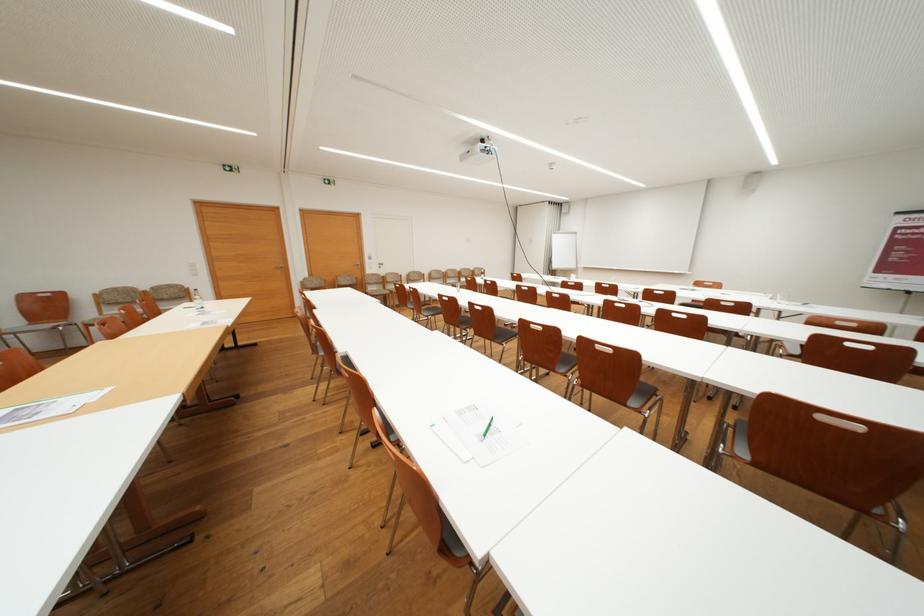
Where would you lift the brown chair back handle? Please return your answer as a coordinate pair (x, y).

(832, 458)